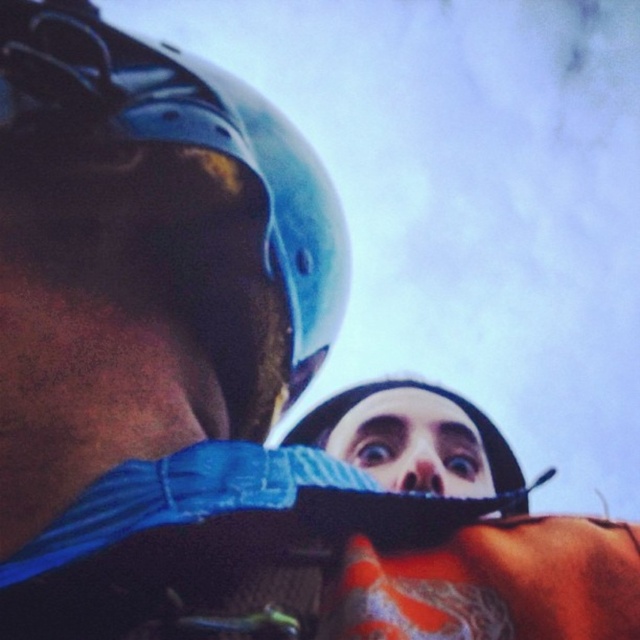
The width and height of the screenshot is (640, 640). Describe the element at coordinates (195, 186) in the screenshot. I see `blue matte helmet at upper left` at that location.

Does point (312, 212) lie in front of point (404, 472)?

Yes.

Is point (272, 323) farther from viewer compared to point (333, 452)?

No, (272, 323) is closer to viewer.

The height and width of the screenshot is (640, 640). I want to click on blue matte helmet at upper left, so [195, 186].